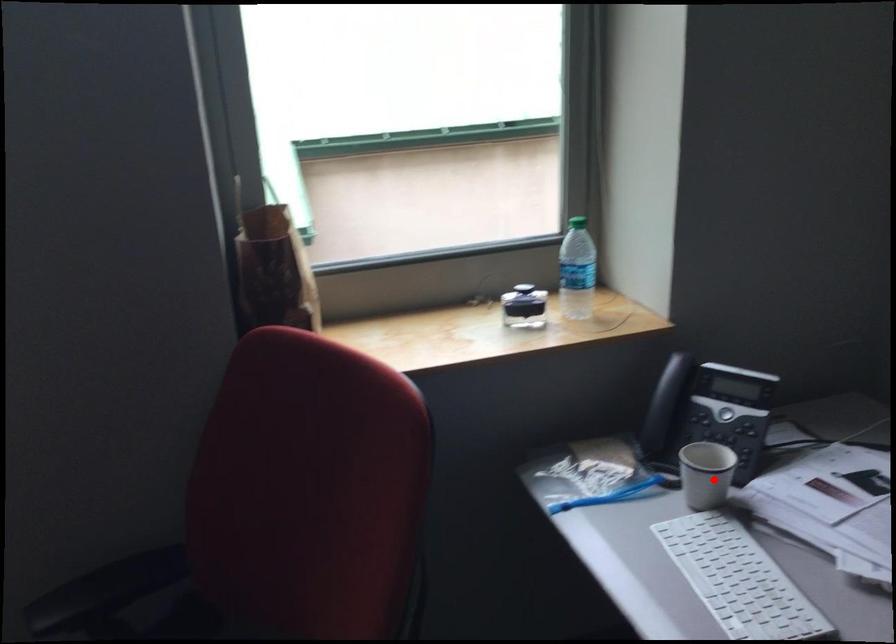
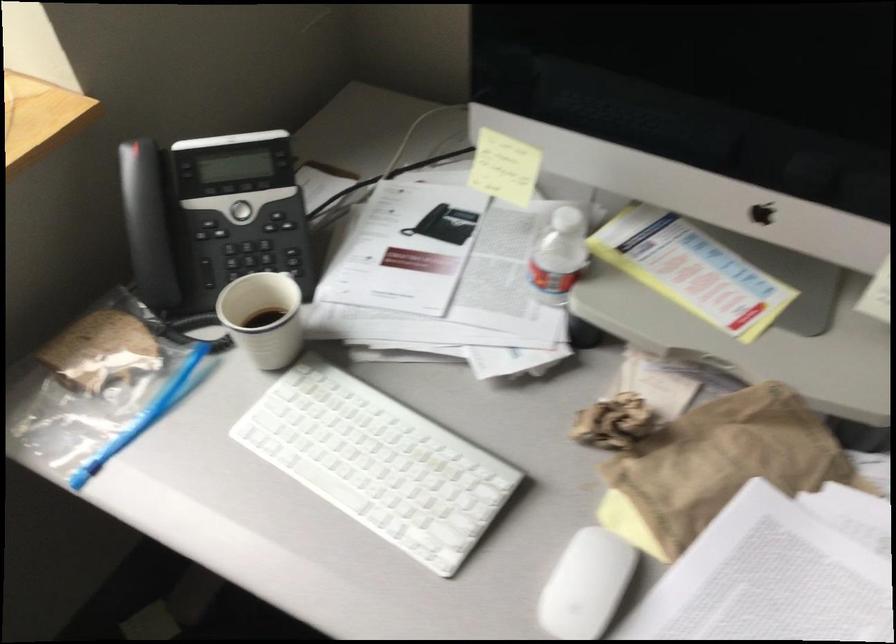
In the second image, find the point that corresponds to the highlighted location in the first image.

(263, 317)